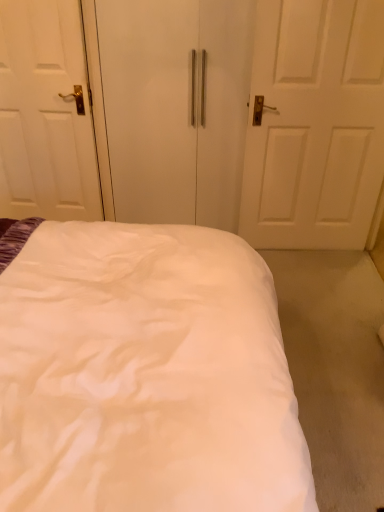
Question: Looking at their shapes, would you say white fabric bed at center is wider or thinner than white glossy door at left?

Choices:
 (A) thin
 (B) wide

Answer: (B)

Question: From the image's perspective, is white fabric bed at center located above or below white glossy door at left?

Choices:
 (A) below
 (B) above

Answer: (A)

Question: Which of these objects is positioned farthest from the white fabric bed at center?

Choices:
 (A) white matte wardrobe at center
 (B) white glossy door at left

Answer: (B)

Question: Estimate the real-world distances between objects in this image. Which object is closer to the white fabric bed at center?

Choices:
 (A) white glossy door at left
 (B) white matte wardrobe at center

Answer: (B)